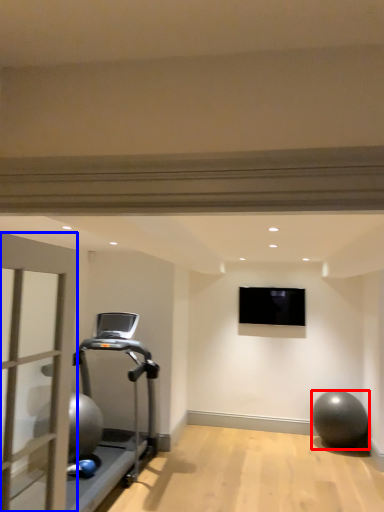
Question: Which of the following is the farthest to the observer, ball (highlighted by a red box) or garage door (highlighted by a blue box)?

Choices:
 (A) ball
 (B) garage door

Answer: (A)